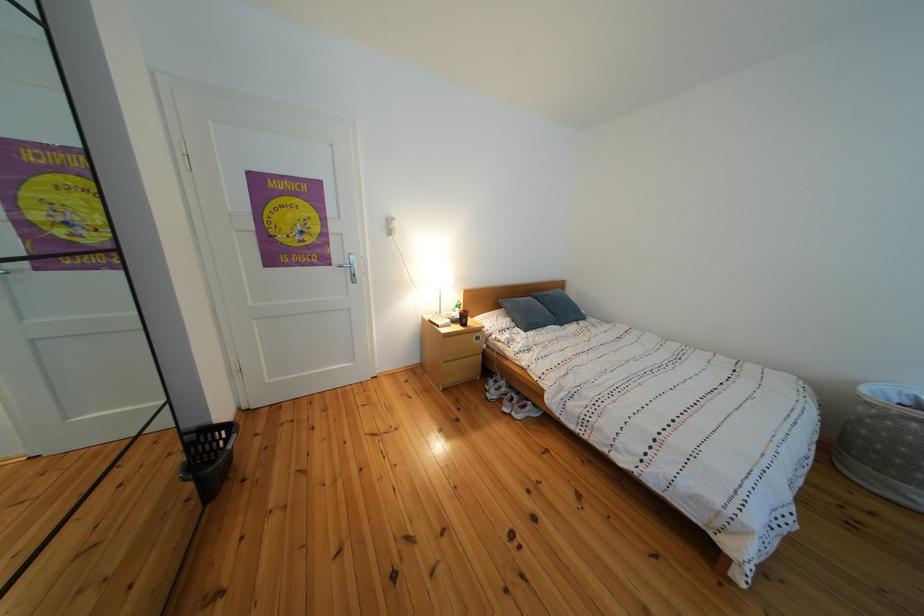
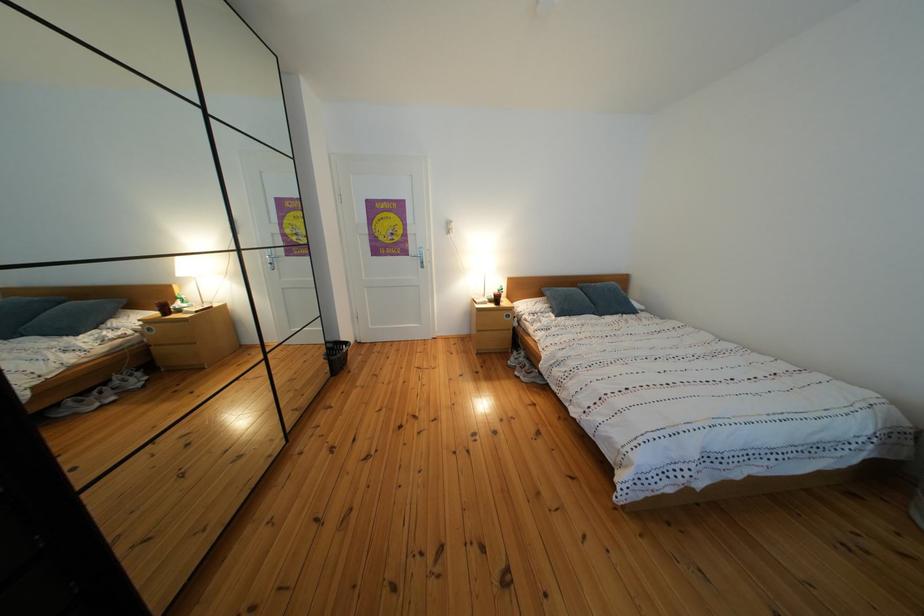
Question: The camera is either moving clockwise (left) or counter-clockwise (right) around the object. The first image is from the beginning of the video and the second image is from the end. Is the camera moving left or right when shooting the video?

Choices:
 (A) Left
 (B) Right

Answer: (B)